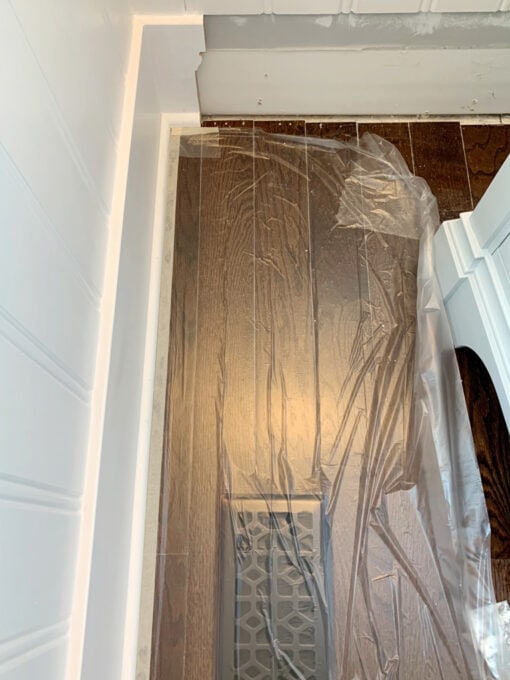
I want to click on wood floor planks, so click(186, 224), click(226, 248), click(285, 166), click(350, 209), click(382, 162), click(442, 183), click(489, 139), click(170, 615), click(498, 578).